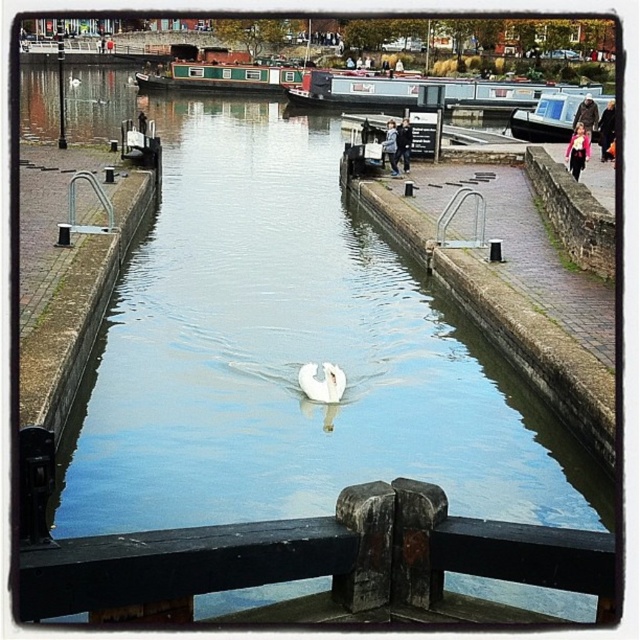
In the scene shown: You are a photographer standing on the dock and want to capture both the black wood rail at center and the green painted wood boat at upper center in a single shot. Given that your camera can only focus on objects within a 2 meter height range, can you take the photo without adjusting your position?

The black wood rail at center is shorter than the green painted wood boat at upper center. Since the height difference between them is within the camera focus range of 2 meters, you can take the photo without adjusting your position.

Based on the photo, you are standing on the right side of the canal, near the stone wall where people are walking. You see a point marked at coordinates (320, 564). What object is located at this point?

The point at (320, 564) marks the location of the black wood rail at center.